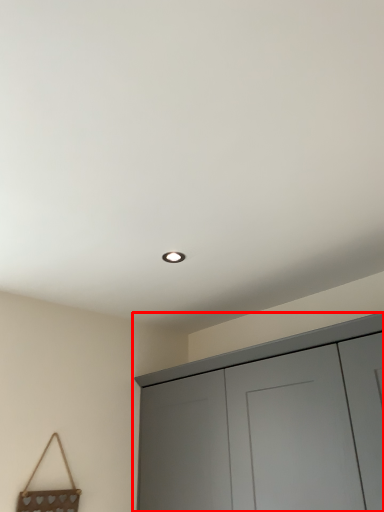
Question: Observing the image, what is the correct spatial positioning of cupboard (annotated by the red box) in reference to handbag?

Choices:
 (A) left
 (B) right

Answer: (B)